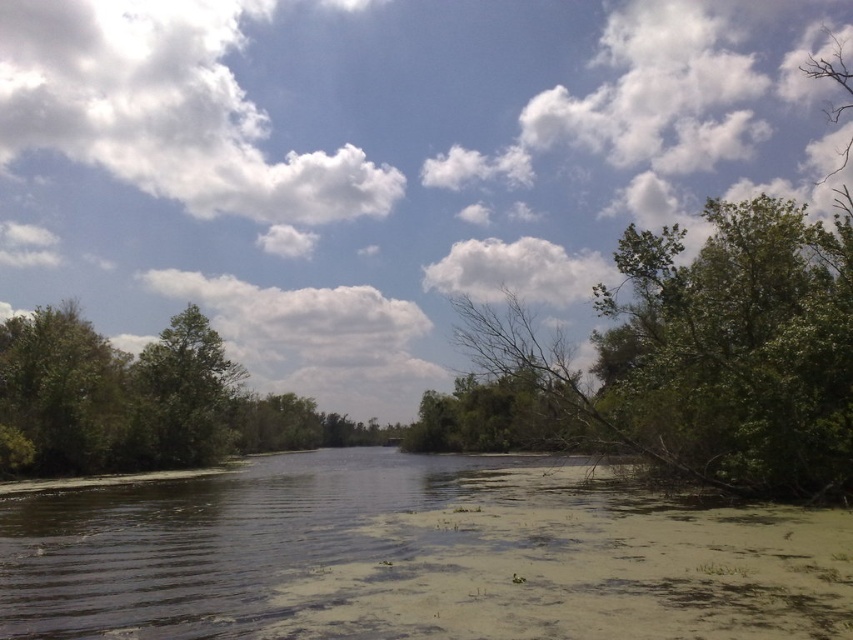
Is point (488, 316) in front of point (113, 401)?

Yes, it is.

Who is more distant from viewer, (648, 236) or (41, 348)?

Positioned behind is point (41, 348).

The width and height of the screenshot is (853, 640). Describe the element at coordinates (709, 353) in the screenshot. I see `green leafy tree at upper right` at that location.

I want to click on green leafy tree at upper right, so click(x=709, y=353).

Is green algae-covered water at center shorter than green leafy tree at upper right?

Correct, green algae-covered water at center is not as tall as green leafy tree at upper right.

Which is more to the left, green algae-covered water at center or green leafy tree at upper right?

From the viewer's perspective, green algae-covered water at center appears more on the left side.

Which is behind, point (352, 573) or point (827, 376)?

The point (827, 376) is more distant.

You are a GUI agent. You are given a task and a screenshot of the screen. Output one action in this format:
    pyautogui.click(x=<x>, y=<y>)
    Task: Click on the green algae-covered water at center
    The image size is (853, 640).
    Given the screenshot: What is the action you would take?
    pyautogui.click(x=415, y=556)

Can you confirm if green algae-covered water at center is taller than green leafy tree at left?

No, green algae-covered water at center is not taller than green leafy tree at left.

Does green algae-covered water at center appear on the left side of green leafy tree at left?

No, green algae-covered water at center is not to the left of green leafy tree at left.

From the picture: Measure the distance between green algae-covered water at center and camera.

They are 26.41 feet apart.

Locate an element on the screen. The width and height of the screenshot is (853, 640). green algae-covered water at center is located at coordinates (415, 556).